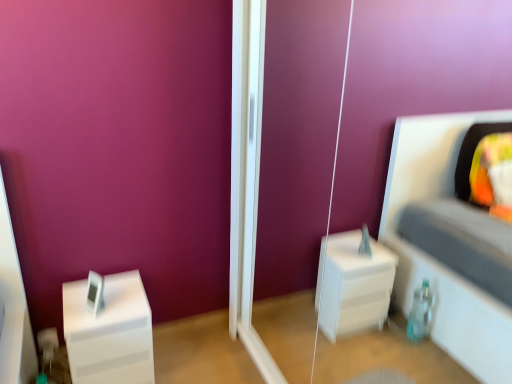
Question: In terms of size, does transparent glass door at center appear bigger or smaller than white glossy nightstand at left?

Choices:
 (A) small
 (B) big

Answer: (B)

Question: Which is correct: transparent glass door at center is inside white glossy nightstand at left, or outside of it?

Choices:
 (A) outside
 (B) inside

Answer: (A)

Question: From the image's perspective, relative to white glossy nightstand at left, is transparent glass door at center above or below?

Choices:
 (A) above
 (B) below

Answer: (A)

Question: From their relative heights in the image, would you say white glossy nightstand at left is taller or shorter than transparent glass door at center?

Choices:
 (A) tall
 (B) short

Answer: (B)

Question: From the image's perspective, is white glossy nightstand at left positioned above or below transparent glass door at center?

Choices:
 (A) below
 (B) above

Answer: (A)

Question: Is white glossy nightstand at left inside the boundaries of transparent glass door at center, or outside?

Choices:
 (A) inside
 (B) outside

Answer: (B)

Question: Considering the positions of white glossy nightstand at left and transparent glass door at center in the image, is white glossy nightstand at left bigger or smaller than transparent glass door at center?

Choices:
 (A) small
 (B) big

Answer: (A)